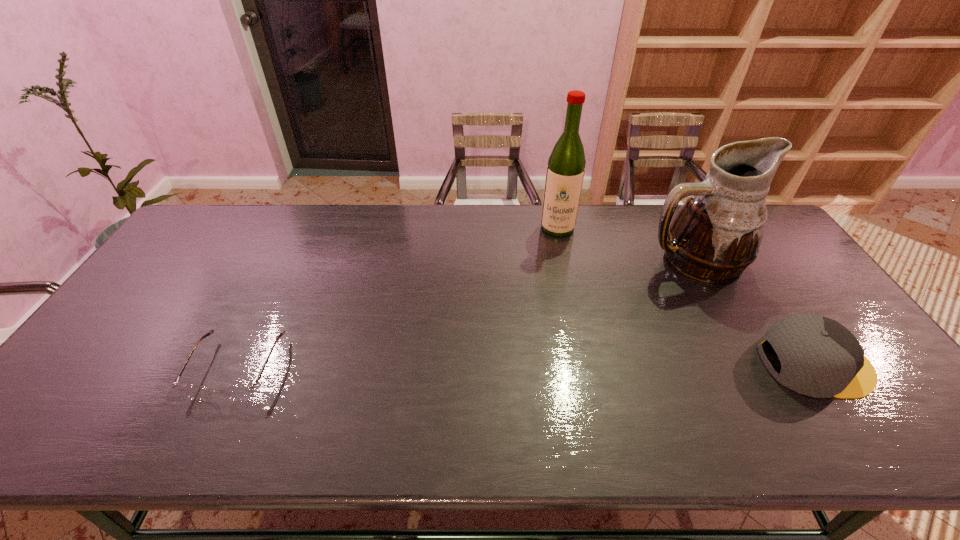
Where is `the leftmost object`? the leftmost object is located at coordinates (236, 392).

The image size is (960, 540). In order to click on spectacles in this screenshot , I will do `click(236, 392)`.

This screenshot has height=540, width=960. In order to click on the second shortest object in this screenshot , I will do `click(820, 358)`.

Find the location of `the third object from right to left`. the third object from right to left is located at coordinates (565, 171).

Image resolution: width=960 pixels, height=540 pixels. In order to click on pitcher in this screenshot , I will do `click(716, 234)`.

Locate an element on the screen. vacant space situated on the label of the third object from right to left is located at coordinates (554, 297).

Where is `vacant region located on the label of the third object from right to left`? Image resolution: width=960 pixels, height=540 pixels. vacant region located on the label of the third object from right to left is located at coordinates (556, 255).

Image resolution: width=960 pixels, height=540 pixels. In order to click on free space located on the label of the third object from right to left in this screenshot , I will do pyautogui.click(x=554, y=307).

Find the location of `free space located from the spout of the pitcher`. free space located from the spout of the pitcher is located at coordinates (635, 325).

This screenshot has width=960, height=540. Find the location of `vacant space situated from the spout of the pitcher`. vacant space situated from the spout of the pitcher is located at coordinates (648, 308).